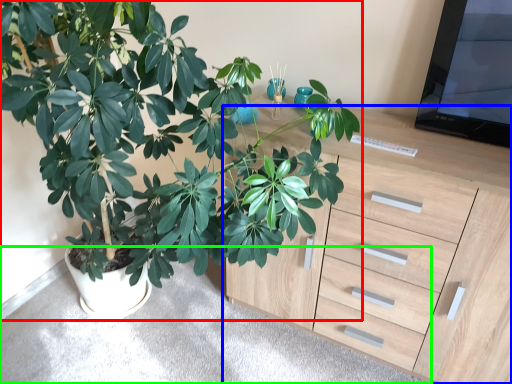
Question: Which object is the closest to the houseplant (highlighted by a red box)? Choose among these: chest of drawers (highlighted by a blue box) or gray (highlighted by a green box).

Choices:
 (A) chest of drawers
 (B) gray

Answer: (A)